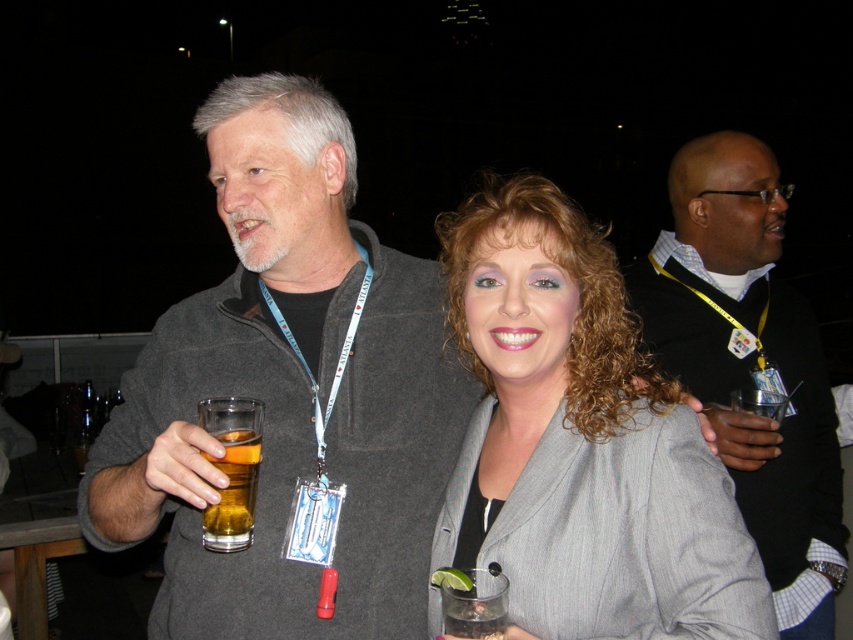
Question: Which point is closer to the camera?

Choices:
 (A) (834, 490)
 (B) (244, 506)
 (C) (520, 189)

Answer: (B)

Question: Which of the following is the closest to the observer?

Choices:
 (A) black sweater at upper right
 (B) translucent glass beer at center
 (C) gray fabric jacket at center

Answer: (C)

Question: Observing the image, what is the correct spatial positioning of black sweater at upper right in reference to translucent glass beer at center?

Choices:
 (A) above
 (B) below

Answer: (A)

Question: Is gray fabric jacket at center bigger than translucent glass beer at center?

Choices:
 (A) no
 (B) yes

Answer: (B)

Question: Is gray fabric jacket at center bigger than translucent glass beer at center?

Choices:
 (A) no
 (B) yes

Answer: (B)

Question: Which object is the farthest from the gray fabric jacket at center?

Choices:
 (A) translucent glass beer at center
 (B) black sweater at upper right

Answer: (A)